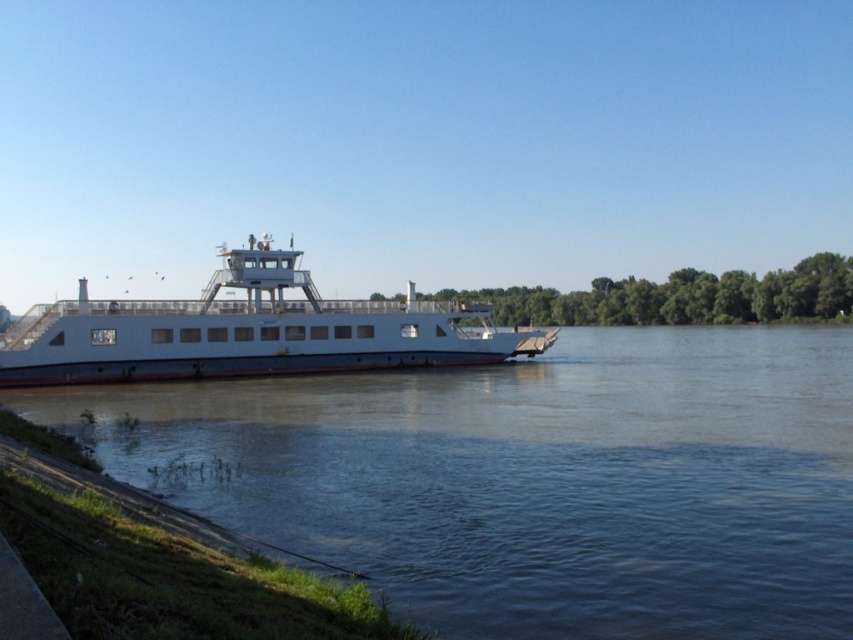
Question: Which point is closer to the camera?

Choices:
 (A) brown matte river at center
 (B) white matte ferry at center

Answer: (A)

Question: Is brown matte river at center positioned at the back of white matte ferry at center?

Choices:
 (A) yes
 (B) no

Answer: (B)

Question: From the image, what is the correct spatial relationship of brown matte river at center in relation to white matte ferry at center?

Choices:
 (A) left
 (B) right

Answer: (B)

Question: Among these objects, which one is farthest from the camera?

Choices:
 (A) white matte ferry at center
 (B) brown matte river at center

Answer: (A)

Question: Does brown matte river at center have a larger size compared to white matte ferry at center?

Choices:
 (A) no
 (B) yes

Answer: (A)